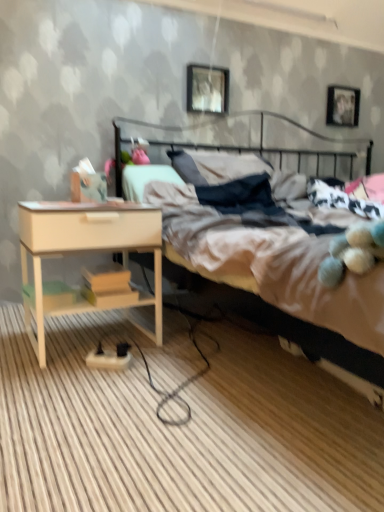
Measure the distance between metallic silver picture frame at upper center, which appears as the 2th picture frame when viewed from the back, and camera.

The depth of metallic silver picture frame at upper center, which appears as the 2th picture frame when viewed from the back, is 7.86 feet.

Where is `metallic bed at center`? The image size is (384, 512). metallic bed at center is located at coordinates point(283,280).

Find the location of a particular element. metallic silver picture frame at upper right, the 1th picture frame positioned from the back is located at coordinates (342, 106).

Where is `beige wood nightstand at lower left`? The width and height of the screenshot is (384, 512). beige wood nightstand at lower left is located at coordinates (87, 250).

This screenshot has width=384, height=512. I want to click on metallic silver picture frame at upper center, positioned as the second picture frame in right-to-left order, so click(x=207, y=89).

Is beige wood nightstand at lower left at the right side of metallic black headboard at upper center?

Incorrect, beige wood nightstand at lower left is not on the right side of metallic black headboard at upper center.

Is beige wood nightstand at lower left placed right next to metallic black headboard at upper center?

No, beige wood nightstand at lower left is not next to metallic black headboard at upper center.

Could you tell me if beige wood nightstand at lower left is turned towards metallic black headboard at upper center?

No, beige wood nightstand at lower left is not turned towards metallic black headboard at upper center.

Relative to metallic black headboard at upper center, is metallic silver picture frame at upper right, the 1th picture frame positioned from the back, in front or behind?

metallic silver picture frame at upper right, the 1th picture frame positioned from the back, is positioned farther from the viewer than metallic black headboard at upper center.

How distant is metallic silver picture frame at upper right, the 1th picture frame positioned from the back, from metallic black headboard at upper center?

metallic silver picture frame at upper right, the 1th picture frame positioned from the back, is 18.09 inches away from metallic black headboard at upper center.

From the image's perspective, count 2nd picture frames upward from the metallic black headboard at upper center and point to it. Please provide its 2D coordinates.

[(342, 106)]

Is metallic silver picture frame at upper right, which appears as the second picture frame when viewed from the left, positioned far away from metallic silver picture frame at upper center, positioned as the 1th picture frame in left-to-right order?

No.

Is metallic silver picture frame at upper right, which appears as the second picture frame when viewed from the left, inside the boundaries of metallic silver picture frame at upper center, which appears as the 2th picture frame when viewed from the back, or outside?

metallic silver picture frame at upper right, which appears as the second picture frame when viewed from the left, exists outside the volume of metallic silver picture frame at upper center, which appears as the 2th picture frame when viewed from the back.

Is metallic silver picture frame at upper right, which appears as the second picture frame when viewed from the left, facing away from metallic silver picture frame at upper center, acting as the 1th picture frame starting from the front?

No.

Is point (335, 112) positioned in front of point (198, 93)?

That is False.

Which object is closer to the camera, beige wood nightstand at lower left or metallic silver picture frame at upper right, which appears as the second picture frame when viewed from the left?

Positioned in front is beige wood nightstand at lower left.

Is beige wood nightstand at lower left outside of metallic silver picture frame at upper right, which appears as the second picture frame when viewed from the left?

Yes, beige wood nightstand at lower left is not within metallic silver picture frame at upper right, which appears as the second picture frame when viewed from the left.

Which of these two, beige wood nightstand at lower left or metallic silver picture frame at upper right, which appears as the second picture frame when viewed from the left, is bigger?

Bigger between the two is beige wood nightstand at lower left.

Starting from the beige wood nightstand at lower left, which picture frame is the 2nd one behind? Please provide its 2D coordinates.

[(342, 106)]

Is metallic black headboard at upper center outside of metallic bed at center?

No, most part of metallic black headboard at upper center lies within metallic bed at center.

Can you tell me how much metallic black headboard at upper center and metallic bed at center differ in facing direction?

There is a 0.795-degree angle between the facing directions of metallic black headboard at upper center and metallic bed at center.

Can you confirm if metallic black headboard at upper center is positioned to the right of metallic bed at center?

Incorrect, metallic black headboard at upper center is not on the right side of metallic bed at center.

Is metallic black headboard at upper center far away from metallic bed at center?

metallic black headboard at upper center is far away from metallic bed at center.

Is the surface of metallic silver picture frame at upper center, positioned as the 1th picture frame in left-to-right order, in direct contact with metallic black headboard at upper center?

metallic silver picture frame at upper center, positioned as the 1th picture frame in left-to-right order, and metallic black headboard at upper center are clearly separated.

Between metallic silver picture frame at upper center, positioned as the second picture frame in right-to-left order, and metallic black headboard at upper center, which one has smaller size?

metallic silver picture frame at upper center, positioned as the second picture frame in right-to-left order.

Is metallic silver picture frame at upper center, which appears as the 2th picture frame when viewed from the back, positioned with its back to metallic black headboard at upper center?

metallic silver picture frame at upper center, which appears as the 2th picture frame when viewed from the back, does not have its back to metallic black headboard at upper center.

From the image's perspective, would you say metallic silver picture frame at upper center, positioned as the 1th picture frame in left-to-right order, is positioned over metallic black headboard at upper center?

Yes, from the image's perspective, metallic silver picture frame at upper center, positioned as the 1th picture frame in left-to-right order, is over metallic black headboard at upper center.

Considering the sizes of objects beige wood nightstand at lower left and metallic silver picture frame at upper center, acting as the 1th picture frame starting from the front, in the image provided, who is smaller, beige wood nightstand at lower left or metallic silver picture frame at upper center, acting as the 1th picture frame starting from the front,?

metallic silver picture frame at upper center, acting as the 1th picture frame starting from the front, is smaller.

Which of these two, beige wood nightstand at lower left or metallic silver picture frame at upper center, which appears as the 2th picture frame when viewed from the back, stands taller?

beige wood nightstand at lower left is taller.

Is beige wood nightstand at lower left oriented towards metallic silver picture frame at upper center, positioned as the 1th picture frame in left-to-right order?

No.

From a real-world perspective, between beige wood nightstand at lower left and metallic silver picture frame at upper center, positioned as the second picture frame in right-to-left order, who is vertically lower?

beige wood nightstand at lower left is physically lower.

The height and width of the screenshot is (512, 384). Find the location of `nightstand located in front of the metallic black headboard at upper center`. nightstand located in front of the metallic black headboard at upper center is located at coordinates (87, 250).

This screenshot has height=512, width=384. Identify the location of headboard that is below the metallic silver picture frame at upper right, which is the 1th picture frame from right to left (from the image's perspective). (248, 142).

Which object lies further to the anchor point metallic silver picture frame at upper center, acting as the 1th picture frame starting from the front, metallic silver picture frame at upper right, which appears as the second picture frame when viewed from the left, or metallic bed at center?

metallic bed at center lies further to metallic silver picture frame at upper center, acting as the 1th picture frame starting from the front, than the other object.

Based on their spatial positions, is metallic black headboard at upper center or beige wood nightstand at lower left further from metallic silver picture frame at upper right, which appears as the second picture frame when viewed from the left?

Among the two, beige wood nightstand at lower left is located further to metallic silver picture frame at upper right, which appears as the second picture frame when viewed from the left.

From the image, which object appears to be nearer to metallic bed at center, beige wood nightstand at lower left or metallic silver picture frame at upper right, the 1th picture frame positioned from the back?

beige wood nightstand at lower left is positioned closer to the anchor metallic bed at center.

Which object lies further to the anchor point metallic bed at center, beige wood nightstand at lower left or metallic black headboard at upper center?

Among the two, metallic black headboard at upper center is located further to metallic bed at center.

Estimate the real-world distances between objects in this image. Which object is closer to metallic black headboard at upper center, metallic silver picture frame at upper center, positioned as the 1th picture frame in left-to-right order, or beige wood nightstand at lower left?

metallic silver picture frame at upper center, positioned as the 1th picture frame in left-to-right order, is closer to metallic black headboard at upper center.

Considering their positions, is beige wood nightstand at lower left positioned closer to metallic black headboard at upper center than metallic silver picture frame at upper center, positioned as the 1th picture frame in left-to-right order?

metallic silver picture frame at upper center, positioned as the 1th picture frame in left-to-right order, lies closer to metallic black headboard at upper center than the other object.

Considering their positions, is metallic silver picture frame at upper center, positioned as the 1th picture frame in left-to-right order, positioned further to metallic black headboard at upper center than metallic bed at center?

metallic bed at center is further to metallic black headboard at upper center.

From the picture: Considering their positions, is metallic silver picture frame at upper center, positioned as the 1th picture frame in left-to-right order, positioned closer to metallic bed at center than metallic silver picture frame at upper right, which is the 1th picture frame from right to left?

Based on the image, metallic silver picture frame at upper center, positioned as the 1th picture frame in left-to-right order, appears to be nearer to metallic bed at center.

At what (x,y) coordinates should I click in order to perform the action: click on picture frame between metallic bed at center and metallic silver picture frame at upper right, acting as the second picture frame starting from the front, in the front-back direction. Please return your answer as a coordinate pair (x, y). This screenshot has height=512, width=384. Looking at the image, I should click on (207, 89).

This screenshot has height=512, width=384. I want to click on headboard between metallic bed at center and metallic silver picture frame at upper center, positioned as the 1th picture frame in left-to-right order, in the front-back direction, so click(248, 142).

At what (x,y) coordinates should I click in order to perform the action: click on headboard between beige wood nightstand at lower left and metallic silver picture frame at upper right, acting as the second picture frame starting from the front, in the front-back direction. Please return your answer as a coordinate pair (x, y). Looking at the image, I should click on (248, 142).

The height and width of the screenshot is (512, 384). In order to click on headboard located between beige wood nightstand at lower left and metallic bed at center in the left-right direction in this screenshot , I will do `click(248, 142)`.